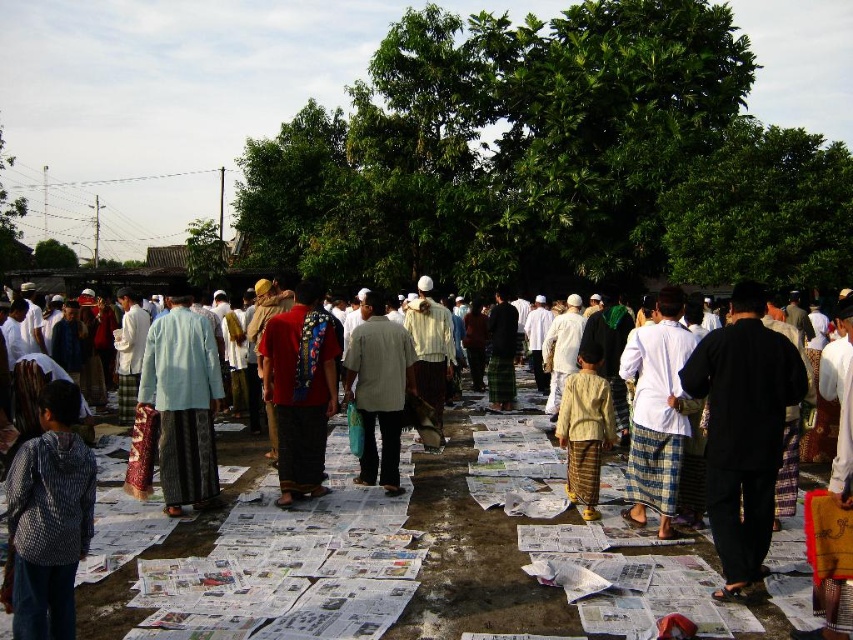
Question: Does white woven cloth at center come in front of light gray fabric shirt at center?

Choices:
 (A) no
 (B) yes

Answer: (B)

Question: Does red fabric bag at center have a greater width compared to white woven cloth at center?

Choices:
 (A) no
 (B) yes

Answer: (A)

Question: Based on their relative distances, which object is nearer to the light gray fabric shirt at center?

Choices:
 (A) light blue fabric at center
 (B) black woven cloth at center
 (C) printed newspaper at center

Answer: (A)

Question: Considering the real-world distances, which object is farthest from the red fabric bag at center?

Choices:
 (A) light blue fabric at center
 (B) checkered fabric shirt at lower left
 (C) black woven cloth at center
 (D) printed newspaper at center

Answer: (C)

Question: Estimate the real-world distances between objects in this image. Which object is farther from the printed newspaper at center?

Choices:
 (A) light blue fabric at center
 (B) red fabric bag at center
 (C) light gray fabric shirt at center

Answer: (C)

Question: Considering the relative positions of printed newspaper at center and yellow striped pants at center in the image provided, where is printed newspaper at center located with respect to yellow striped pants at center?

Choices:
 (A) left
 (B) right

Answer: (A)